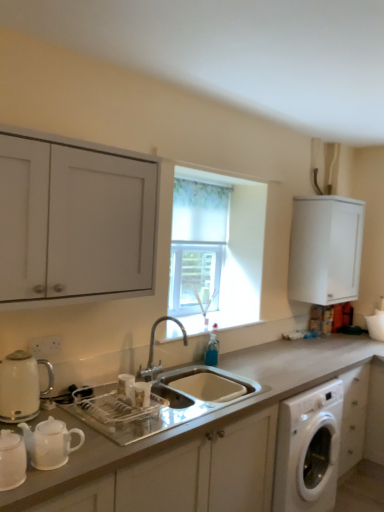
Where is `silver metallic faucet at center`? The height and width of the screenshot is (512, 384). silver metallic faucet at center is located at coordinates (153, 351).

What do you see at coordinates (74, 220) in the screenshot? I see `white matte cabinet at upper left, marked as the 2th cabinetry in a back-to-front arrangement` at bounding box center [74, 220].

Where is `matte white kettle at left`? This screenshot has height=512, width=384. matte white kettle at left is located at coordinates (21, 386).

Locate an element on the screen. The height and width of the screenshot is (512, 384). silver metallic faucet at center is located at coordinates (153, 351).

Which of these two, white matte cabinet at upper right, the 2th cabinetry positioned from the front, or translucent fabric curtain at center, is bigger?

white matte cabinet at upper right, the 2th cabinetry positioned from the front, is bigger.

Is white matte cabinet at upper right, the first cabinetry from the back, at the left side of translucent fabric curtain at center?

No.

Considering the points (307, 223) and (193, 273), which point is behind, point (307, 223) or point (193, 273)?

The point (307, 223) is farther from the camera.

Which of these two, white matte cabinet at upper right, which appears as the 2th cabinetry when viewed from the left, or translucent fabric curtain at center, is thinner?

Thinner between the two is translucent fabric curtain at center.

Can you confirm if silver metallic faucet at center is positioned to the left of white matte cabinet at upper left, the second cabinetry when ordered from right to left?

In fact, silver metallic faucet at center is to the right of white matte cabinet at upper left, the second cabinetry when ordered from right to left.

From the image's perspective, which object appears higher, silver metallic faucet at center or white matte cabinet at upper left, marked as the 2th cabinetry in a back-to-front arrangement?

From the image's view, white matte cabinet at upper left, marked as the 2th cabinetry in a back-to-front arrangement, is above.

Which of these two, silver metallic faucet at center or white matte cabinet at upper left, the first cabinetry positioned from the left, is bigger?

white matte cabinet at upper left, the first cabinetry positioned from the left, is bigger.

At what (x,y) coordinates should I click in order to perform the action: click on tap below the white matte cabinet at upper left, marked as the 2th cabinetry in a back-to-front arrangement (from the image's perspective). Please return your answer as a coordinate pair (x, y). This screenshot has height=512, width=384. Looking at the image, I should click on (153, 351).

From a real-world perspective, relative to silver metallic faucet at center, is white matte cabinet at upper left, which is counted as the first cabinetry, starting from the front, vertically above or below?

white matte cabinet at upper left, which is counted as the first cabinetry, starting from the front, is above silver metallic faucet at center.

Between white matte cabinet at upper left, the first cabinetry positioned from the left, and silver metallic faucet at center, which one has smaller width?

Thinner between the two is silver metallic faucet at center.

Is white matte cabinet at upper left, marked as the 2th cabinetry in a back-to-front arrangement, aimed at silver metallic faucet at center?

No, white matte cabinet at upper left, marked as the 2th cabinetry in a back-to-front arrangement, is not turned towards silver metallic faucet at center.

Which of these two, translucent fabric curtain at center or white matte cabinet at upper left, which is counted as the first cabinetry, starting from the front, stands taller?

With more height is translucent fabric curtain at center.

Is translucent fabric curtain at center in front of or behind white matte cabinet at upper left, the second cabinetry when ordered from right to left, in the image?

In the image, translucent fabric curtain at center appears behind white matte cabinet at upper left, the second cabinetry when ordered from right to left.

Where is `bay window located underneath the white matte cabinet at upper left, which is counted as the first cabinetry, starting from the front (from a real-world perspective)`? bay window located underneath the white matte cabinet at upper left, which is counted as the first cabinetry, starting from the front (from a real-world perspective) is located at coordinates (197, 245).

Is matte white kettle at left in contact with white matte cabinet at upper left, the first cabinetry positioned from the left?

matte white kettle at left and white matte cabinet at upper left, the first cabinetry positioned from the left, are not in contact.

Is matte white kettle at left positioned before white matte cabinet at upper left, marked as the 2th cabinetry in a back-to-front arrangement?

No, matte white kettle at left is behind white matte cabinet at upper left, marked as the 2th cabinetry in a back-to-front arrangement.

From the image's perspective, is matte white kettle at left above or below white matte cabinet at upper left, the second cabinetry when ordered from right to left?

From the image's perspective, matte white kettle at left appears below white matte cabinet at upper left, the second cabinetry when ordered from right to left.

From a real-world perspective, does white matte countertop at center stand above white matte cabinet at upper left, marked as the 2th cabinetry in a back-to-front arrangement?

No.

Can you confirm if white matte countertop at center is wider than white matte cabinet at upper left, the first cabinetry positioned from the left?

Indeed, white matte countertop at center has a greater width compared to white matte cabinet at upper left, the first cabinetry positioned from the left.

Is white matte cabinet at upper left, the second cabinetry when ordered from right to left, located within white matte countertop at center?

No, white matte cabinet at upper left, the second cabinetry when ordered from right to left, is not a part of white matte countertop at center.

Is white matte countertop at center positioned behind white matte cabinet at upper left, marked as the 2th cabinetry in a back-to-front arrangement?

No, white matte countertop at center is closer to the viewer.

Is white matte cabinet at upper right, which ranks as the 1th cabinetry in right-to-left order, completely or partially outside of white matte cabinet at upper left, the second cabinetry when ordered from right to left?

That's correct, white matte cabinet at upper right, which ranks as the 1th cabinetry in right-to-left order, is outside of white matte cabinet at upper left, the second cabinetry when ordered from right to left.

Considering the relative sizes of white matte cabinet at upper right, the 2th cabinetry positioned from the front, and white matte cabinet at upper left, which is counted as the first cabinetry, starting from the front, in the image provided, is white matte cabinet at upper right, the 2th cabinetry positioned from the front, smaller than white matte cabinet at upper left, which is counted as the first cabinetry, starting from the front,?

Actually, white matte cabinet at upper right, the 2th cabinetry positioned from the front, might be larger than white matte cabinet at upper left, which is counted as the first cabinetry, starting from the front.

Based on the photo, is white matte cabinet at upper right, the 2th cabinetry positioned from the front, positioned with its back to white matte cabinet at upper left, which is counted as the first cabinetry, starting from the front?

white matte cabinet at upper right, the 2th cabinetry positioned from the front, is not turned away from white matte cabinet at upper left, which is counted as the first cabinetry, starting from the front.

Can you confirm if white matte cabinet at upper right, the 2th cabinetry positioned from the front, is positioned to the left of white matte cabinet at upper left, which is counted as the first cabinetry, starting from the front?

No, white matte cabinet at upper right, the 2th cabinetry positioned from the front, is not to the left of white matte cabinet at upper left, which is counted as the first cabinetry, starting from the front.

This screenshot has height=512, width=384. Identify the location of cabinetry lying on the right of translucent fabric curtain at center. (325, 249).

Locate an element on the screen. Image resolution: width=384 pixels, height=512 pixels. tap below the white matte cabinet at upper left, which is counted as the first cabinetry, starting from the front (from a real-world perspective) is located at coordinates (153, 351).

Considering their positions, is white matte cabinet at upper right, which appears as the 2th cabinetry when viewed from the left, positioned further to matte white kettle at left than translucent fabric curtain at center?

Among the two, white matte cabinet at upper right, which appears as the 2th cabinetry when viewed from the left, is located further to matte white kettle at left.

Estimate the real-world distances between objects in this image. Which object is further from translucent fabric curtain at center, white matte cabinet at upper right, which appears as the 2th cabinetry when viewed from the left, or white matte countertop at center?

white matte countertop at center.

Based on their spatial positions, is white matte cabinet at upper left, which is counted as the first cabinetry, starting from the front, or white matte countertop at center closer to silver metallic faucet at center?

white matte countertop at center is positioned closer to the anchor silver metallic faucet at center.

Which object lies nearer to the anchor point white matte cabinet at upper right, the 2th cabinetry positioned from the front, matte white kettle at left or silver metallic faucet at center?

silver metallic faucet at center.

Based on their spatial positions, is white matte cabinet at upper left, the first cabinetry positioned from the left, or silver metallic faucet at center further from white matte cabinet at upper right, which ranks as the 1th cabinetry in right-to-left order?

white matte cabinet at upper left, the first cabinetry positioned from the left, is further to white matte cabinet at upper right, which ranks as the 1th cabinetry in right-to-left order.

When comparing their distances from white matte cabinet at upper right, the 2th cabinetry positioned from the front, does silver metallic faucet at center or matte white kettle at left seem further?

The object further to white matte cabinet at upper right, the 2th cabinetry positioned from the front, is matte white kettle at left.

Which object lies nearer to the anchor point white matte countertop at center, white matte cabinet at upper right, which ranks as the 1th cabinetry in right-to-left order, or white matte cabinet at upper left, which is counted as the first cabinetry, starting from the front?

white matte cabinet at upper right, which ranks as the 1th cabinetry in right-to-left order.

From the image, which object appears to be farther from white matte countertop at center, white matte cabinet at upper right, which ranks as the 1th cabinetry in right-to-left order, or translucent fabric curtain at center?

translucent fabric curtain at center.

Locate an element on the screen. tap between white matte cabinet at upper left, which is counted as the first cabinetry, starting from the front, and white matte cabinet at upper right, which appears as the 2th cabinetry when viewed from the left is located at coordinates (153, 351).

In order to click on tap located between matte white kettle at left and translucent fabric curtain at center in the depth direction in this screenshot , I will do `click(153, 351)`.

You are a GUI agent. You are given a task and a screenshot of the screen. Output one action in this format:
    pyautogui.click(x=<x>, y=<y>)
    Task: Click on the bay window between matte white kettle at left and white matte cabinet at upper right, which appears as the 2th cabinetry when viewed from the left, from left to right
    The width and height of the screenshot is (384, 512).
    Given the screenshot: What is the action you would take?
    click(197, 245)

You are a GUI agent. You are given a task and a screenshot of the screen. Output one action in this format:
    pyautogui.click(x=<x>, y=<y>)
    Task: Click on the appliance between white matte cabinet at upper left, which is counted as the first cabinetry, starting from the front, and translucent fabric curtain at center from front to back
    
    Given the screenshot: What is the action you would take?
    pyautogui.click(x=21, y=386)